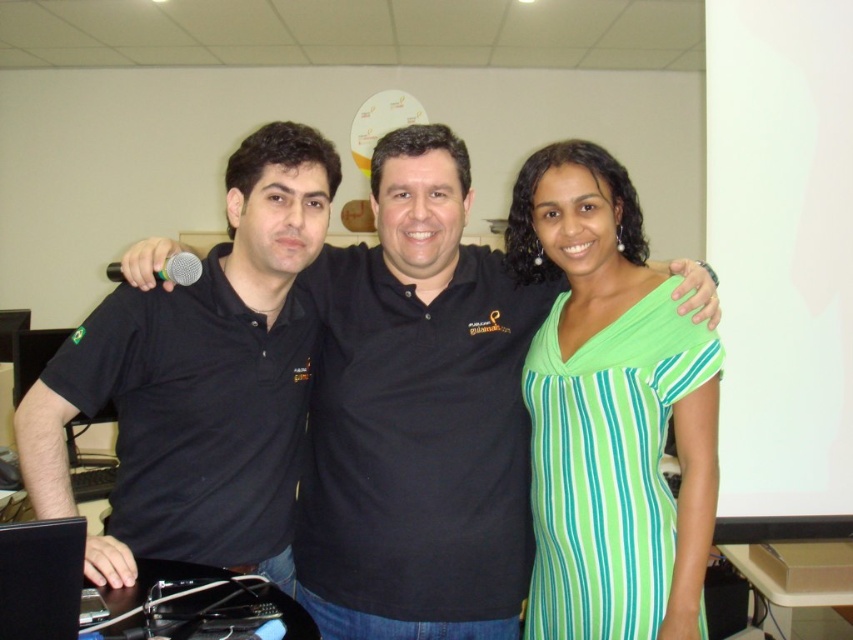
Which of these two, black matte shirt at left or black glossy laptop at lower left, stands taller?

Standing taller between the two is black matte shirt at left.

Is point (300, 253) closer to viewer compared to point (50, 580)?

No, it is not.

Where is `black matte shirt at left`? black matte shirt at left is located at coordinates (199, 381).

Is point (466, 625) closer to viewer compared to point (648, 372)?

No, it is not.

Locate an element on the screen. black cotton polo shirt at center is located at coordinates (416, 416).

Find the location of `black cotton polo shirt at center`. black cotton polo shirt at center is located at coordinates pyautogui.click(x=416, y=416).

Measure the distance between green striped dress at center and camera.

green striped dress at center is 1.34 meters away from camera.

Who is higher up, green striped dress at center or black glossy laptop at lower left?

Positioned higher is green striped dress at center.

Between point (618, 524) and point (21, 618), which one is positioned behind?

Positioned behind is point (618, 524).

Where is `green striped dress at center`? green striped dress at center is located at coordinates (610, 412).